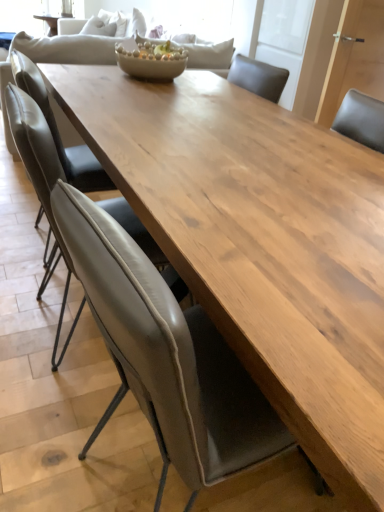
Question: Considering the positions of leather at center, which is counted as the third chair, starting from the back, and leather at left, arranged as the first chair when viewed from the back, in the image, is leather at center, which is counted as the third chair, starting from the back, wider or thinner than leather at left, arranged as the first chair when viewed from the back,?

Choices:
 (A) wide
 (B) thin

Answer: (A)

Question: In the image, is leather at center, which is counted as the third chair, starting from the back, positioned in front of or behind leather at left, the third chair positioned from the front?

Choices:
 (A) behind
 (B) front

Answer: (B)

Question: Which object is the farthest from the leather at left, the third chair positioned from the front?

Choices:
 (A) matte ceramic bowl at center
 (B) matte gray chair at center, the second chair viewed from the back
 (C) leather at center, which is counted as the third chair, starting from the back

Answer: (C)

Question: Which is nearer to the matte ceramic bowl at center?

Choices:
 (A) matte gray chair at center, the 2th chair in the front-to-back sequence
 (B) leather at center, which is counted as the third chair, starting from the back
 (C) leather at left, arranged as the first chair when viewed from the back

Answer: (C)